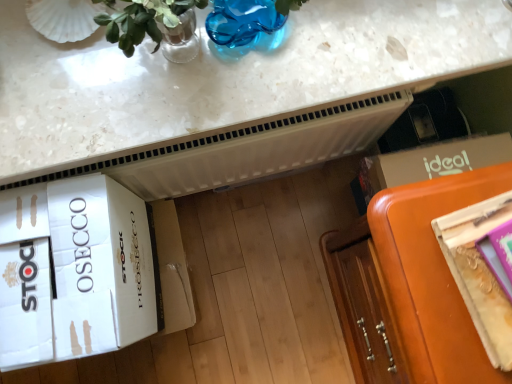
Where is `vacant space in front of blue glass vase at upper center`? This screenshot has height=384, width=512. vacant space in front of blue glass vase at upper center is located at coordinates (217, 92).